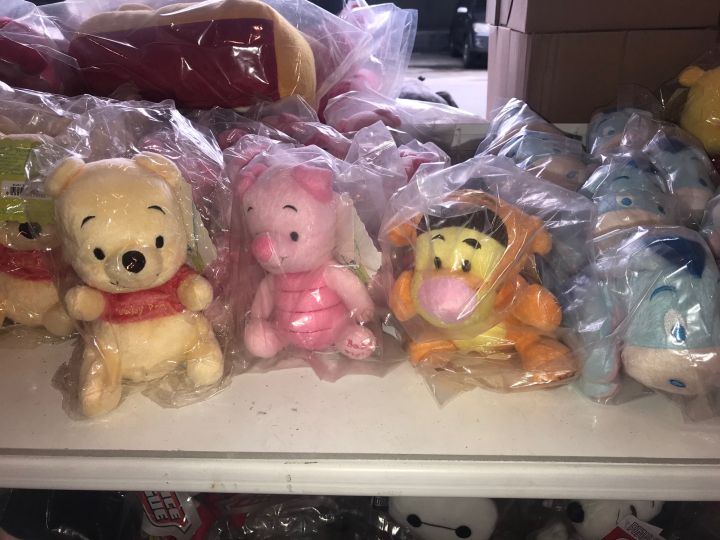
The height and width of the screenshot is (540, 720). I want to click on eeyore plush toys, so click(651, 308), click(630, 202), click(688, 180), click(618, 136), click(549, 154), click(715, 213), click(567, 219).